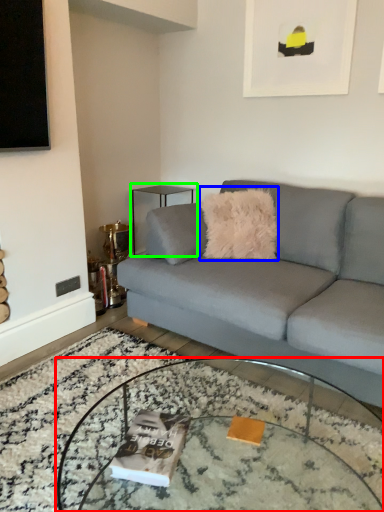
Question: Which object is the closest to the coffee table (highlighted by a red box)? Choose among these: throw pillow (highlighted by a blue box) or side table (highlighted by a green box).

Choices:
 (A) throw pillow
 (B) side table

Answer: (A)